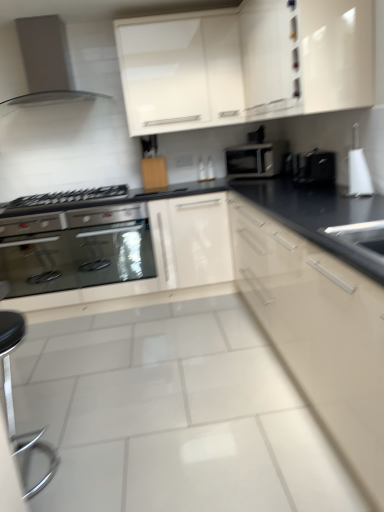
Question: Looking at the image, does wooden cutting board at center, marked as the third cabinetry in a right-to-left arrangement, seem bigger or smaller compared to satin metallic range hood at upper left?

Choices:
 (A) big
 (B) small

Answer: (B)

Question: Based on their positions, is wooden cutting board at center, the first cabinetry viewed from the left, located to the left or right of satin metallic range hood at upper left?

Choices:
 (A) right
 (B) left

Answer: (A)

Question: Estimate the real-world distances between objects in this image. Which object is farther from the satin silver toaster at center?

Choices:
 (A) stainless steel oven at lower left
 (B) white glossy kettle at upper right, which is counted as the second appliance, starting from the back
 (C) wooden cutting board at center, marked as the third cabinetry in a right-to-left arrangement
 (D) white glossy cabinet at upper center, which is the 3th cabinetry in left-to-right order
 (E) white glossy cabinet at upper center, which is counted as the second cabinetry, starting from the left

Answer: (A)

Question: Which object is the closest to the black glass gas stove at left?

Choices:
 (A) polished chrome bar stool at lower left
 (B) wooden cutting board at center, the first cabinetry viewed from the left
 (C) white glossy cabinet at upper center, acting as the first cabinetry starting from the right
 (D) satin silver toaster at center
 (E) black plastic knife block at center, the 2th appliance viewed from the front

Answer: (B)